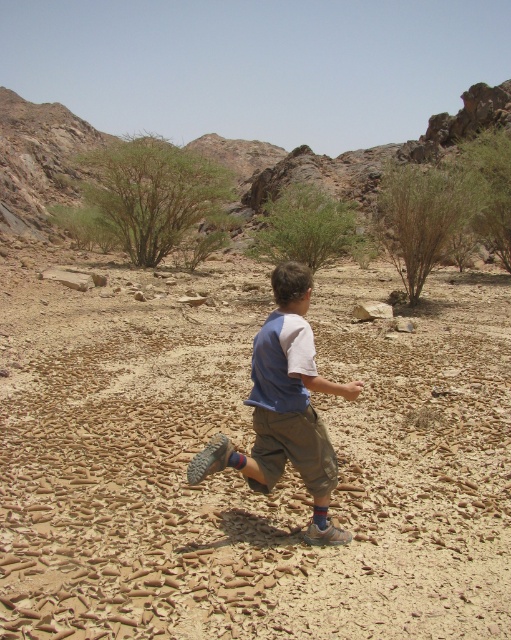
Looking at this image, is brown cracked sand at center in front of blue cotton shirt at center?

That is True.

Describe the element at coordinates (247, 451) in the screenshot. Image resolution: width=511 pixels, height=640 pixels. I see `brown cracked sand at center` at that location.

You are a GUI agent. You are given a task and a screenshot of the screen. Output one action in this format:
    pyautogui.click(x=<x>, y=<y>)
    Task: Click on the brown cracked sand at center
    The height and width of the screenshot is (640, 511).
    Given the screenshot: What is the action you would take?
    pyautogui.click(x=247, y=451)